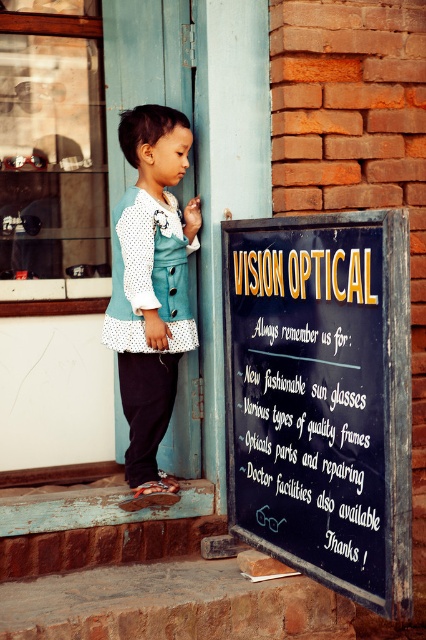
Question: Does black chalkboard at center have a greater width compared to white chalkboard at center?

Choices:
 (A) yes
 (B) no

Answer: (A)

Question: Which of these objects is positioned closest to the black chalkboard at center?

Choices:
 (A) white chalkboard at center
 (B) white dotted fabric dress at center

Answer: (A)

Question: Is white chalkboard at center above white dotted fabric dress at center?

Choices:
 (A) no
 (B) yes

Answer: (A)

Question: Which point is closer to the camera taking this photo?

Choices:
 (A) (359, 417)
 (B) (180, 134)
 (C) (342, 545)

Answer: (A)

Question: Which point is closer to the camera taking this photo?

Choices:
 (A) (365, 483)
 (B) (402, 600)
 (C) (143, 109)

Answer: (B)

Question: Can you confirm if white chalkboard at center is smaller than white dotted fabric dress at center?

Choices:
 (A) no
 (B) yes

Answer: (A)